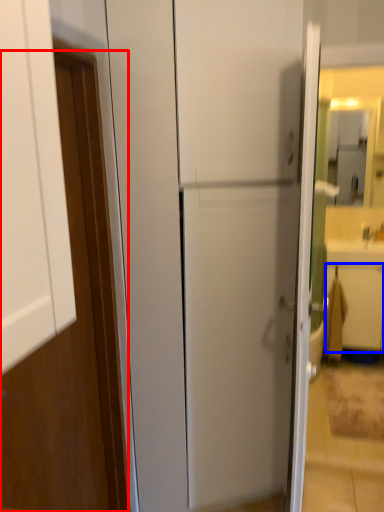
Question: Which object appears closest to the camera in this image, door (highlighted by a red box) or drawer (highlighted by a blue box)?

Choices:
 (A) door
 (B) drawer

Answer: (A)